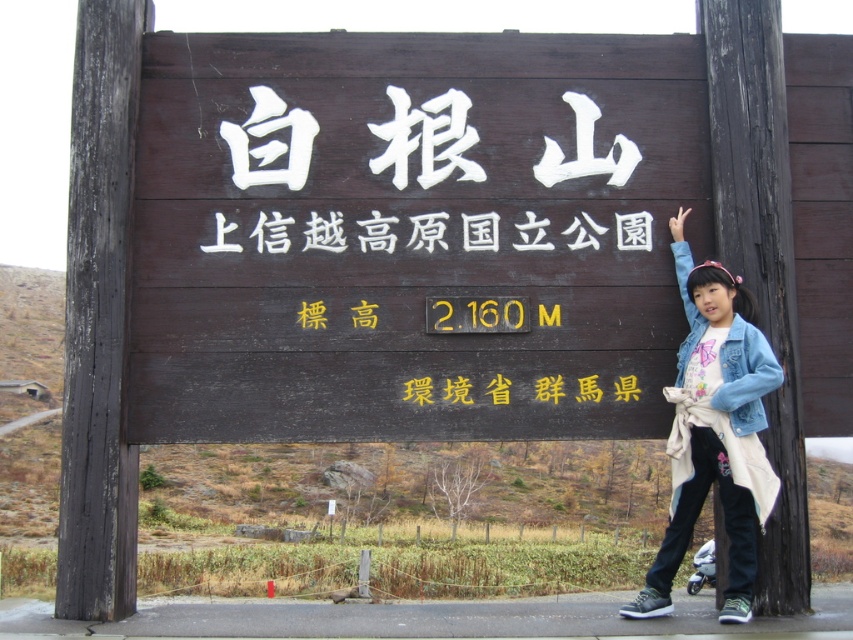
Does dark wood post at right have a smaller size compared to white wood sign at center?

No, dark wood post at right is not smaller than white wood sign at center.

Consider the image. Who is more distant from viewer, (767, 269) or (444, 248)?

The point (767, 269) is more distant.

The height and width of the screenshot is (640, 853). Find the location of `dark wood post at right`. dark wood post at right is located at coordinates pyautogui.click(x=761, y=256).

Find the location of a particular element. This screenshot has width=853, height=640. dark wood post at right is located at coordinates (761, 256).

Between dark wood sign at center and white wood sign at center, which one is positioned higher?

Positioned higher is dark wood sign at center.

Can you confirm if dark wood sign at center is wider than white wood sign at center?

Yes, dark wood sign at center is wider than white wood sign at center.

You are a GUI agent. You are given a task and a screenshot of the screen. Output one action in this format:
    pyautogui.click(x=<x>, y=<y>)
    Task: Click on the dark wood sign at center
    
    Given the screenshot: What is the action you would take?
    pyautogui.click(x=409, y=234)

Is denim jacket at right below white wood sign at center?

Correct, denim jacket at right is located below white wood sign at center.

Measure the distance between denim jacket at right and camera.

They are 7.25 meters apart.

You are a GUI agent. You are given a task and a screenshot of the screen. Output one action in this format:
    pyautogui.click(x=<x>, y=<y>)
    Task: Click on the denim jacket at right
    The width and height of the screenshot is (853, 640).
    Given the screenshot: What is the action you would take?
    pyautogui.click(x=714, y=429)